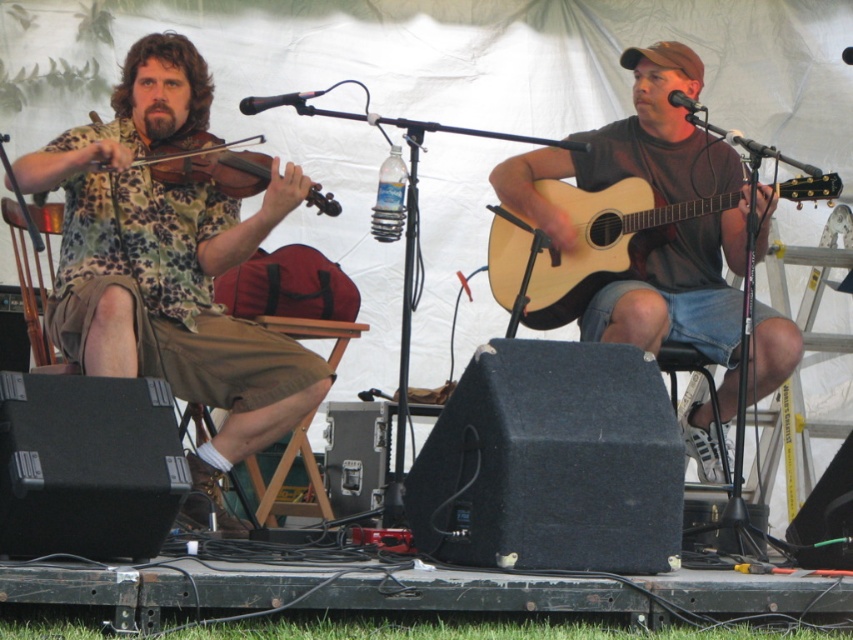
You are standing at the camera position and want to walk towards the point at coordinates point (625, 179). How far will you have to walk to reach that point?

The point (625, 179) is 17.67 feet away from the camera, so you will have to walk 17.67 feet to reach it.

You are a photographer positioned behind the stage. You need to capture a photo that includes both the matte brown guitar at center and the matte black violin at left. Which instrument should you adjust the camera angle to focus on first to ensure both are in frame?

The matte brown guitar at center is located below the matte black violin at left, so you should focus on the matte black violin at left first to ensure both are in frame.